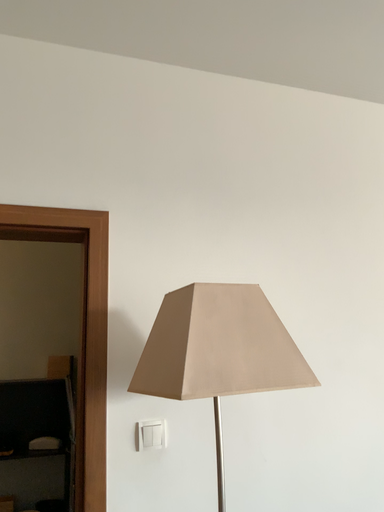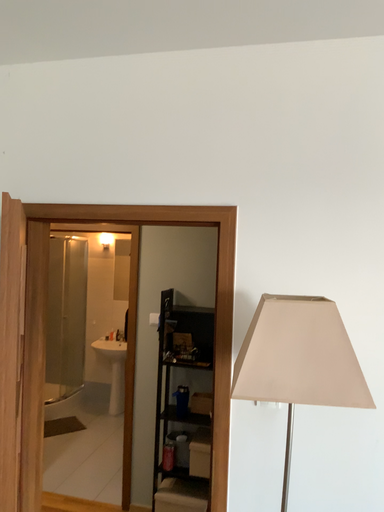
Question: Which way did the camera rotate in the video?

Choices:
 (A) rotated upward
 (B) rotated downward

Answer: (B)